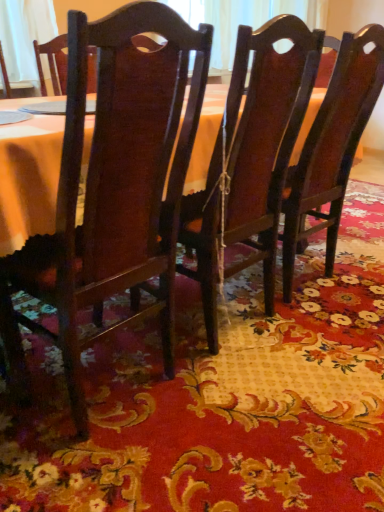
Question: From a real-world perspective, is glossy wood chair at center, which is counted as the third chair, starting from the left, located higher than floral-patterned fabric at center?

Choices:
 (A) no
 (B) yes

Answer: (B)

Question: Is glossy wood chair at center, the first chair in the right-to-left sequence, beside floral-patterned fabric at center?

Choices:
 (A) yes
 (B) no

Answer: (B)

Question: Is glossy wood chair at center, the first chair in the right-to-left sequence, taller than floral-patterned fabric at center?

Choices:
 (A) no
 (B) yes

Answer: (B)

Question: Is glossy wood chair at center, the first chair in the right-to-left sequence, oriented away from floral-patterned fabric at center?

Choices:
 (A) no
 (B) yes

Answer: (A)

Question: Considering the relative sizes of glossy wood chair at center, the first chair in the right-to-left sequence, and floral-patterned fabric at center in the image provided, is glossy wood chair at center, the first chair in the right-to-left sequence, shorter than floral-patterned fabric at center?

Choices:
 (A) no
 (B) yes

Answer: (A)

Question: Considering the relative positions of glossy wood chair at center, which is counted as the third chair, starting from the left, and floral-patterned fabric at center in the image provided, is glossy wood chair at center, which is counted as the third chair, starting from the left, to the right of floral-patterned fabric at center from the viewer's perspective?

Choices:
 (A) no
 (B) yes

Answer: (A)

Question: Does dark wood chair at center, which ranks as the 2th chair in right-to-left order, have a lesser width compared to matte wood chair at center, which ranks as the 1th chair in left-to-right order?

Choices:
 (A) no
 (B) yes

Answer: (A)

Question: From the image's perspective, does dark wood chair at center, which is counted as the 2th chair, starting from the left, appear lower than matte wood chair at center, arranged as the third chair when viewed from the right?

Choices:
 (A) yes
 (B) no

Answer: (B)

Question: Is dark wood chair at center, which is counted as the 2th chair, starting from the left, next to matte wood chair at center, arranged as the third chair when viewed from the right, and touching it?

Choices:
 (A) no
 (B) yes

Answer: (A)

Question: Does dark wood chair at center, which ranks as the 2th chair in right-to-left order, have a lesser height compared to matte wood chair at center, arranged as the third chair when viewed from the right?

Choices:
 (A) yes
 (B) no

Answer: (B)

Question: Can you confirm if dark wood chair at center, which is counted as the 2th chair, starting from the left, is positioned to the left of matte wood chair at center, which ranks as the 1th chair in left-to-right order?

Choices:
 (A) no
 (B) yes

Answer: (A)

Question: Would you say dark wood chair at center, which ranks as the 2th chair in right-to-left order, is a long distance from matte wood chair at center, arranged as the third chair when viewed from the right?

Choices:
 (A) yes
 (B) no

Answer: (B)

Question: Does dark wood chair at center, which is counted as the 2th chair, starting from the left, have a greater width compared to glossy wood chair at center, the first chair in the right-to-left sequence?

Choices:
 (A) no
 (B) yes

Answer: (B)